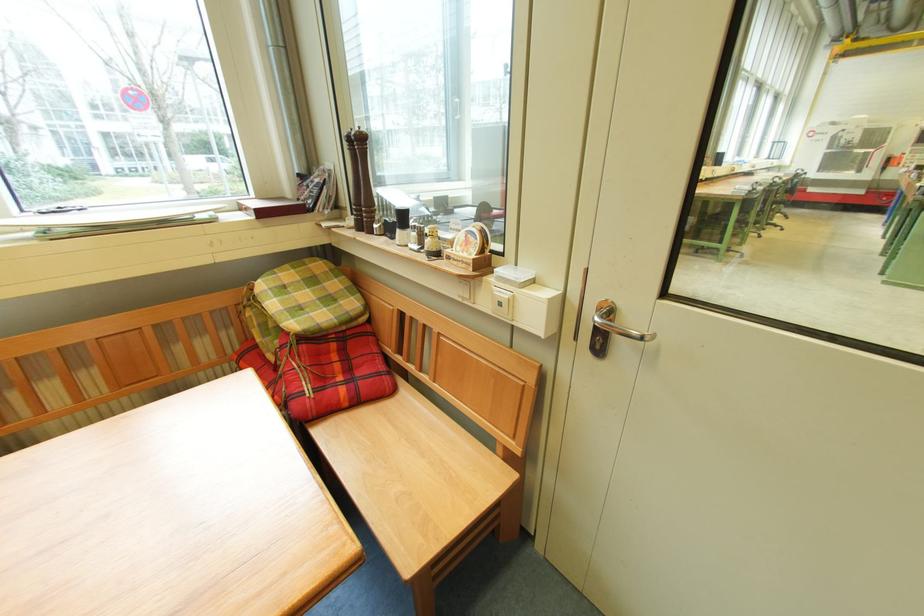
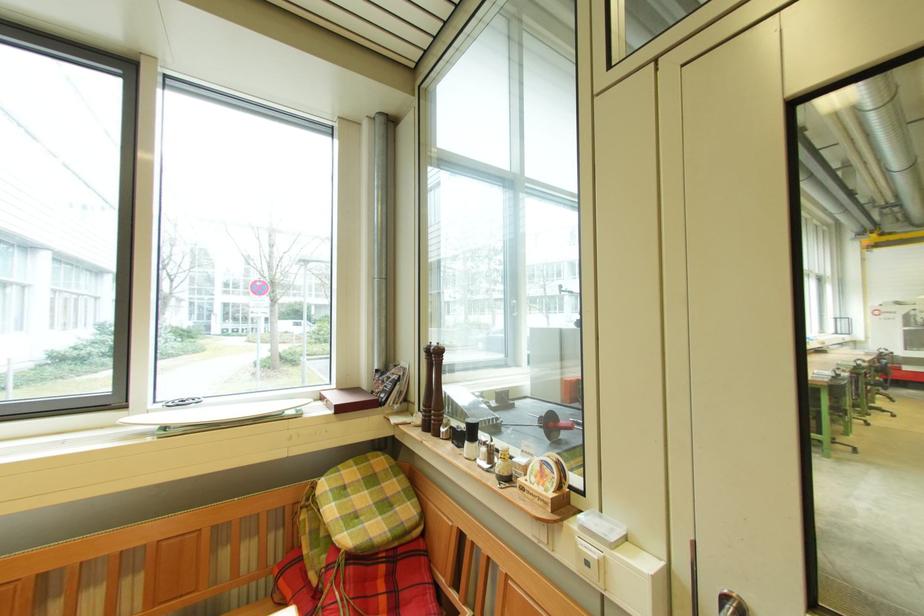
Question: The images are taken continuously from a first-person perspective. In which direction is your viewpoint rotating?

Choices:
 (A) Left
 (B) Right
 (C) Up
 (D) Down

Answer: (C)